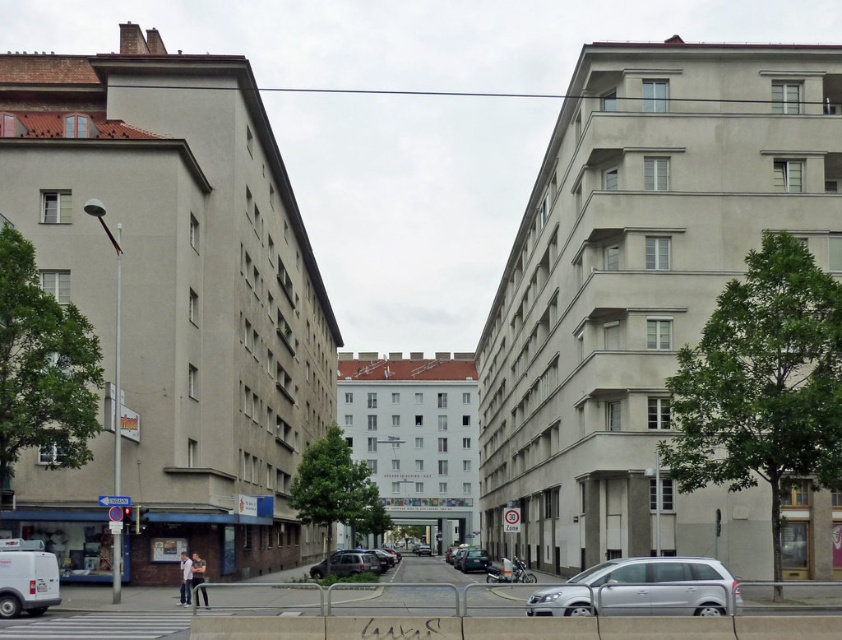
Question: Estimate the real-world distances between objects in this image. Which object is closer to the silver metallic car at lower center?

Choices:
 (A) metallic silver sedan at center
 (B) matte black car at center

Answer: (B)

Question: Which point is farther to the camera?

Choices:
 (A) matte black car at center
 (B) metallic silver sedan at center

Answer: (B)

Question: Which point appears closest to the camera in this image?

Choices:
 (A) (372, 564)
 (B) (606, 577)

Answer: (B)

Question: Considering the relative positions of silver metallic car at lower center and metallic silver sedan at center in the image provided, where is silver metallic car at lower center located with respect to metallic silver sedan at center?

Choices:
 (A) below
 (B) above

Answer: (B)

Question: Can you confirm if matte black car at center is positioned to the left of metallic silver sedan at center?

Choices:
 (A) no
 (B) yes

Answer: (B)

Question: Is matte black car at center above metallic silver sedan at center?

Choices:
 (A) yes
 (B) no

Answer: (A)